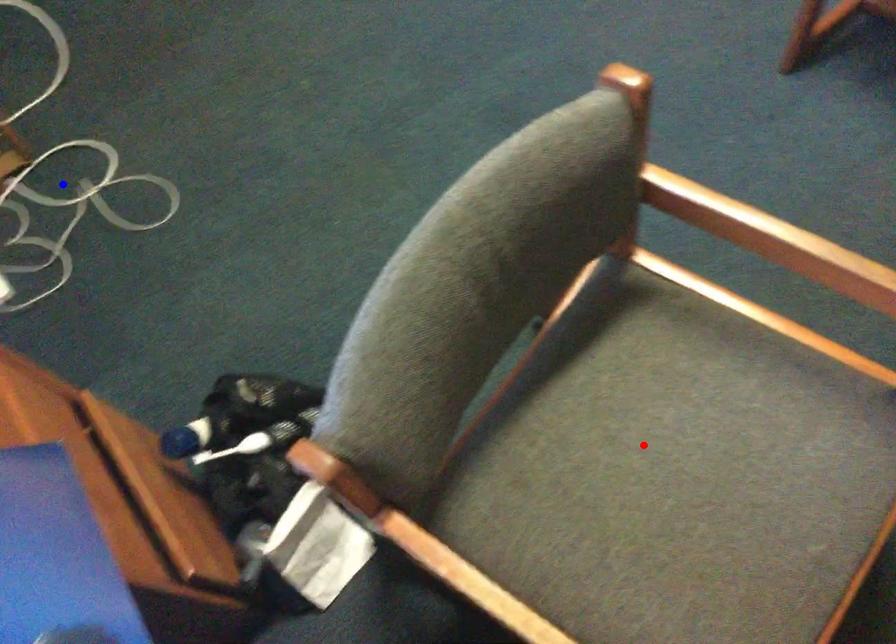
Question: Two points are marked on the image. Which point is closer to the camera?

Choices:
 (A) Blue point is closer.
 (B) Red point is closer.

Answer: (B)